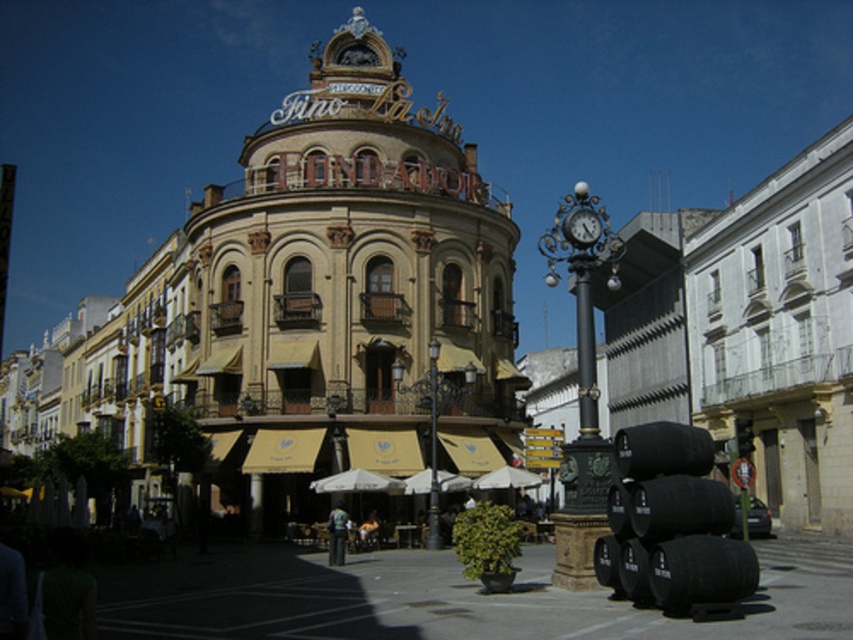
Can you confirm if gold metallic sign at center is bigger than metallic clock at center-right?

Yes.

This screenshot has height=640, width=853. What do you see at coordinates (351, 291) in the screenshot? I see `gold metallic sign at center` at bounding box center [351, 291].

I want to click on gold metallic sign at center, so click(351, 291).